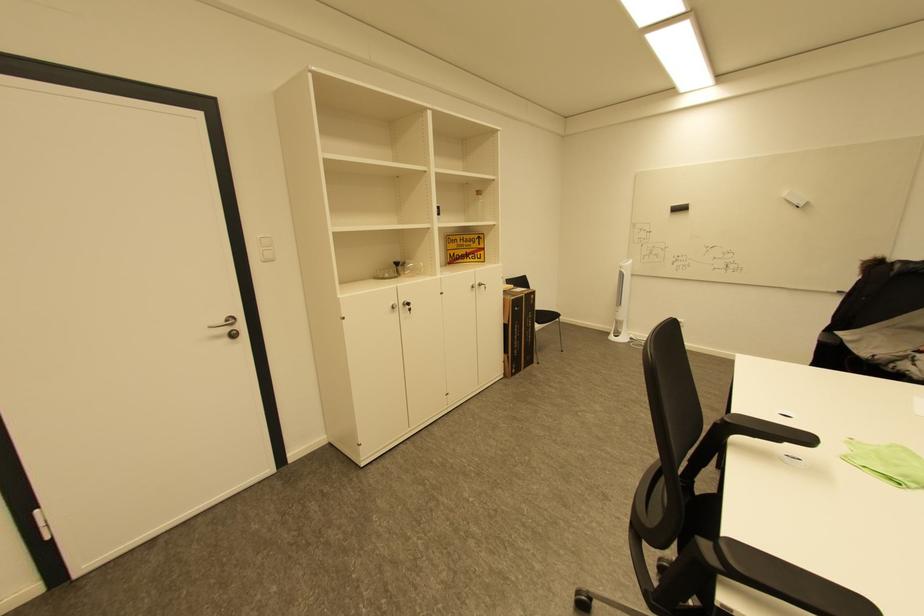
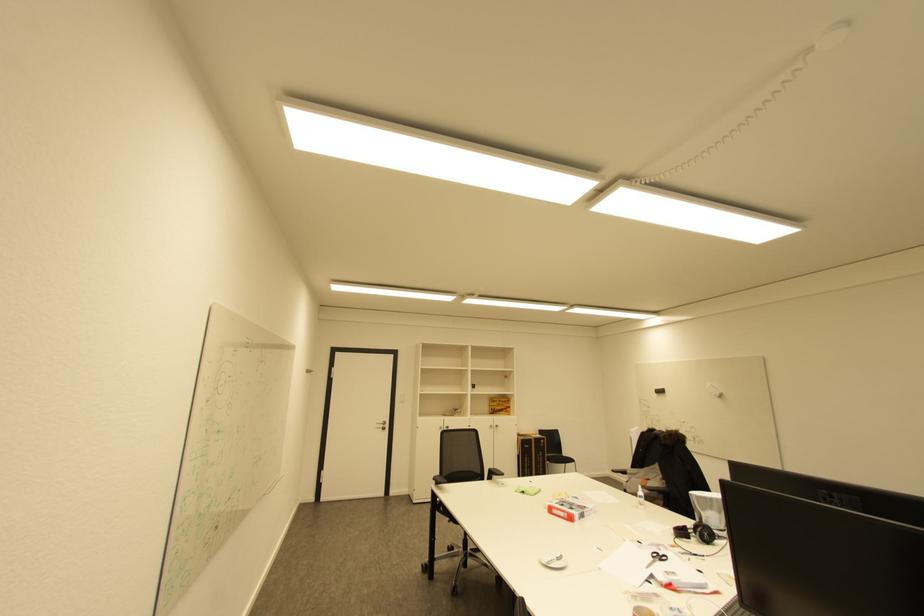
Find the pixel in the second image that matches (x=224, y=338) in the first image.

(385, 429)